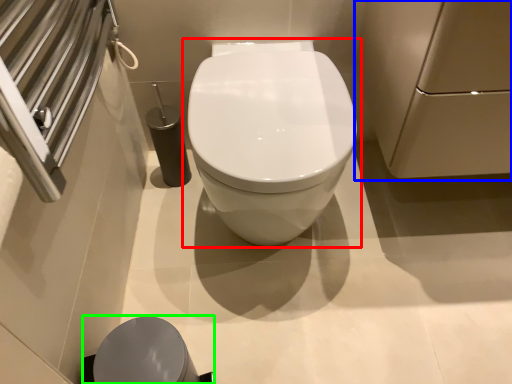
Question: Which object is positioned closest to toilet (highlighted by a red box)? Select from screen door (highlighted by a blue box) and porcelain (highlighted by a green box).

Choices:
 (A) screen door
 (B) porcelain

Answer: (A)